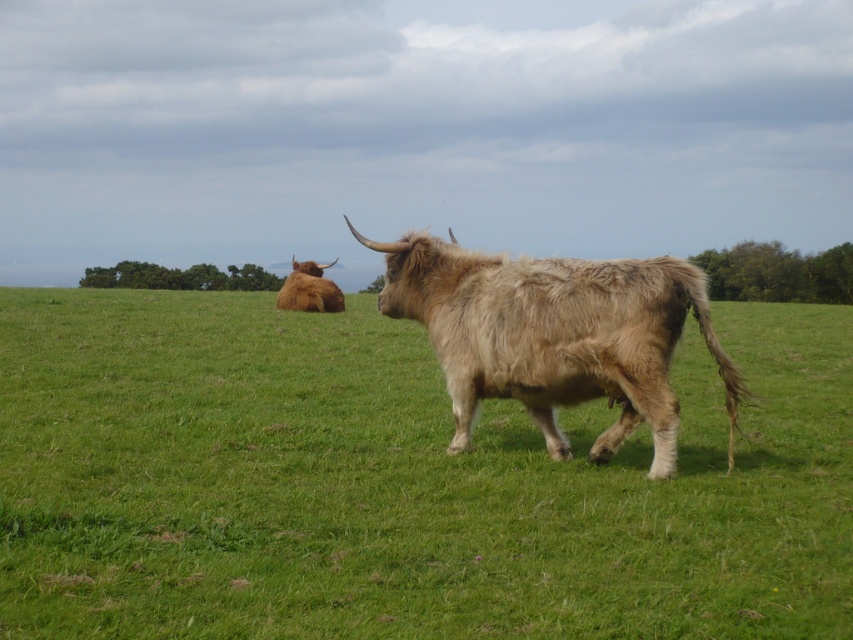
You are a photographer standing at the edge of the field. You want to take a photo that includes both the green soft grass at center and the brown fuzzy yak at upper left. Considering their distance apart, will you be able to fit both into your camera frame without moving your position?

The green soft grass at center is 8.79 meters away from the brown fuzzy yak at upper left. Since the two objects are separated by a significant distance, it may be challenging to capture both in a single frame without moving your position. However, the exact possibility depends on the camera lens used. A wide angle lens could potentially include both, but a standard or telephoto lens might not. Without knowing the specific lens details, it is uncertain.

You are a farmer checking the field. You notice the fuzzy beige buffalo at center and the brown fuzzy yak at upper left. Which animal takes up less horizontal space in the image?

The fuzzy beige buffalo at center has a lesser width compared to the brown fuzzy yak at upper left, so it takes up less horizontal space.

Based on the photo, you are standing in the field and want to take a photo of both the green soft grass at center and the brown fuzzy yak at upper left. Which object should you focus on first to ensure both are in sharp focus?

You should focus on the green soft grass at center first because it is closer to the viewer than the brown fuzzy yak at upper left, so adjusting focus starting from the closer object ensures both will be in focus.